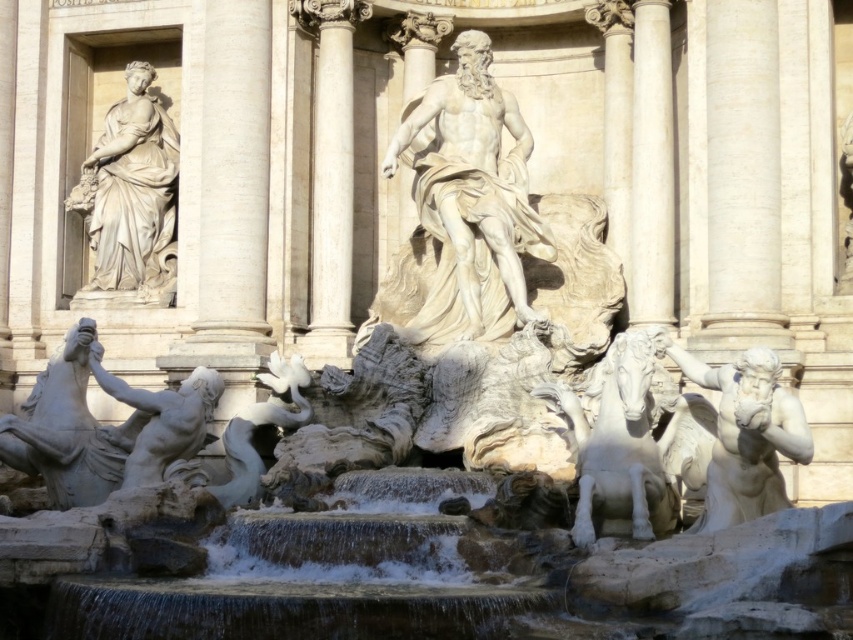
You are standing at the Trevi Fountain and want to toss a coin into the water. You notice two objects nearby, the white marble horse at lower left and the white marble statue at lower left. Which one is positioned further to the left?

The white marble horse at lower left is positioned further to the left compared to the white marble statue at lower left.

You are visiting the Trevi Fountain and want to take a photo of both the white marble horse at lower left and the white marble statue at lower left. Which object should you position closer to the camera to ensure both fit in the frame?

Since the white marble horse at lower left is wider than the white marble statue at lower left, you should position the white marble horse at lower left closer to the camera to ensure both fit in the frame.